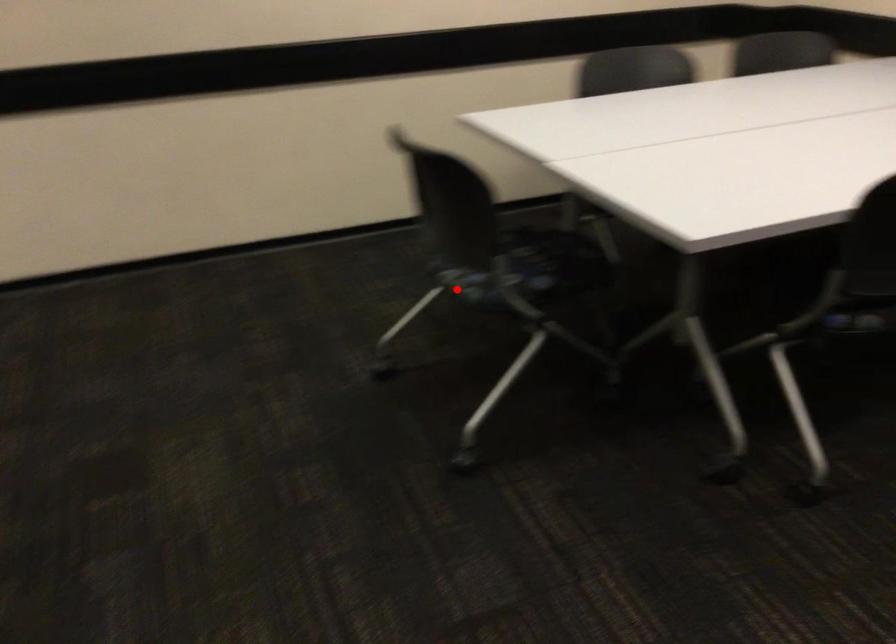
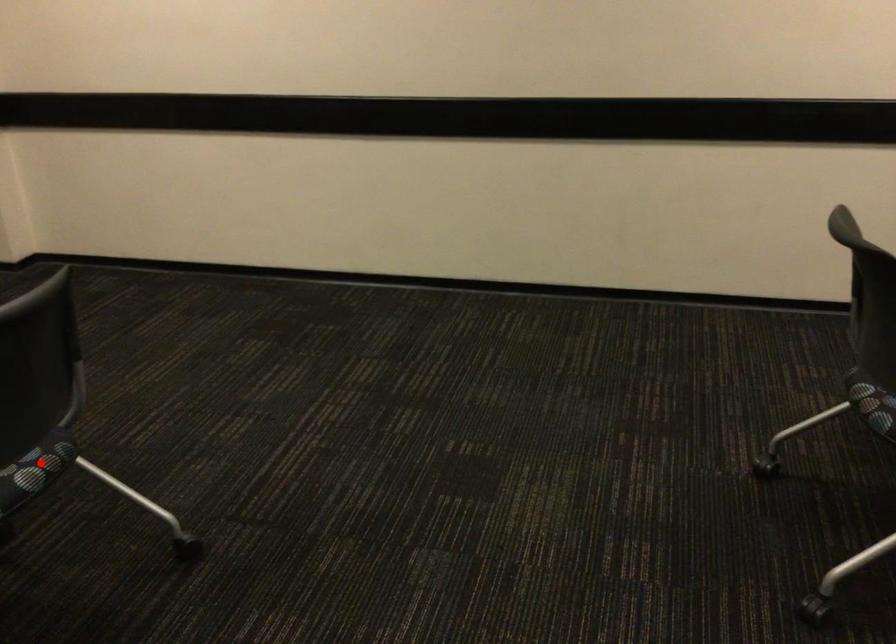
I am providing you with two images of the same scene from different viewpoints. A red point is marked on the first image and another point is marked on the second image. Does the point marked in image1 correspond to the same location as the one in image2?

No